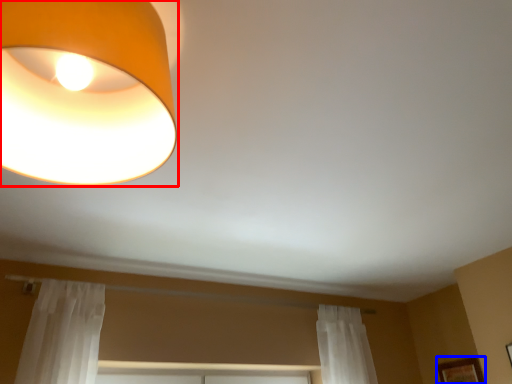
Question: Which point is closer to the camera, lamp (highlighted by a red box) or picture frame (highlighted by a blue box)?

Choices:
 (A) lamp
 (B) picture frame

Answer: (A)